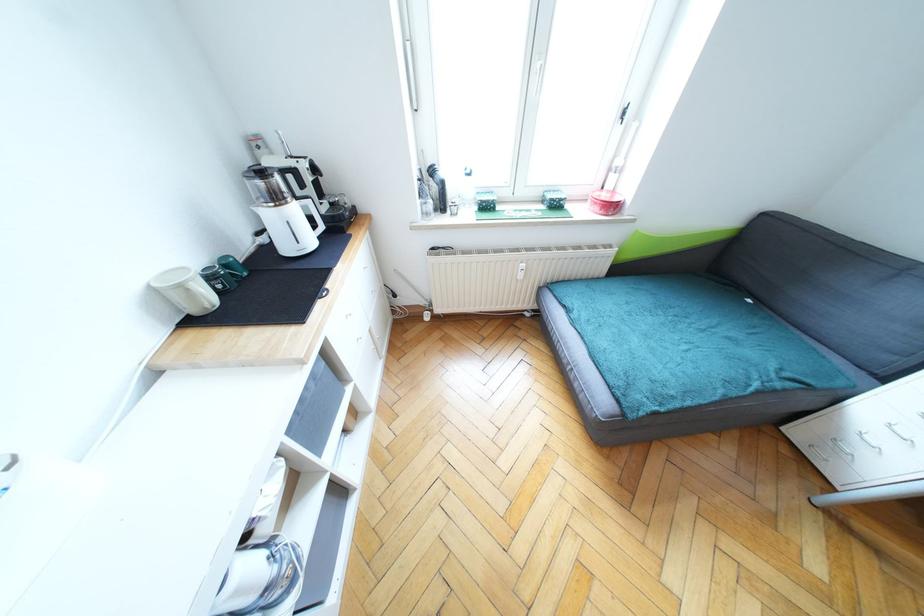
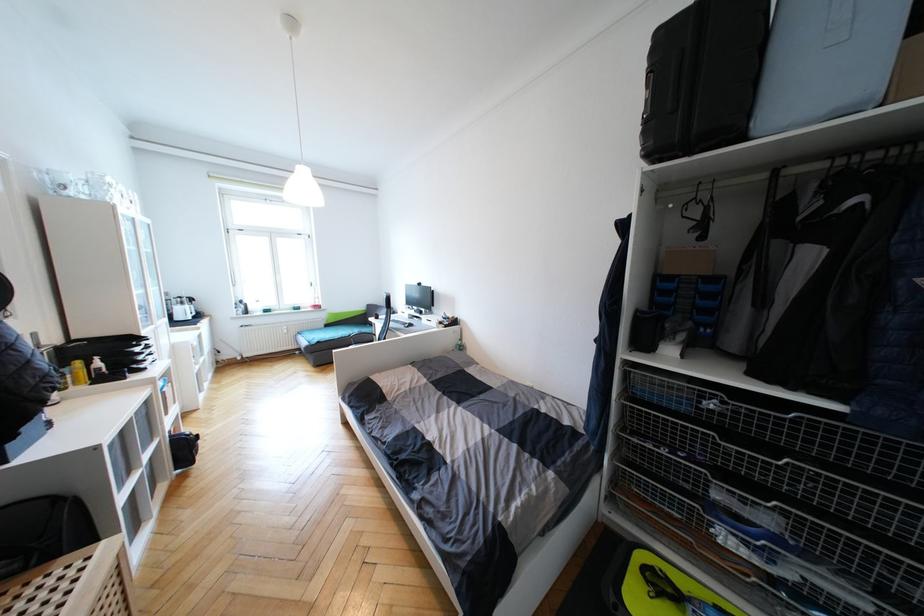
Locate, in the second image, the point that corresponds to pixel 280 198 in the first image.

(186, 305)